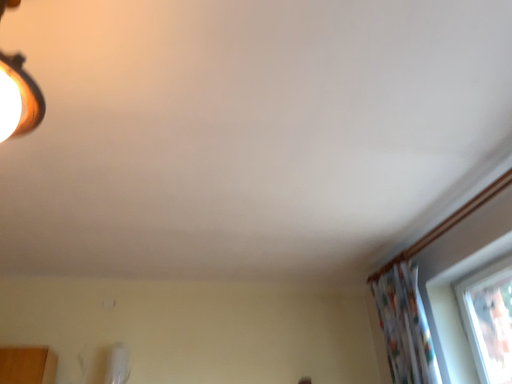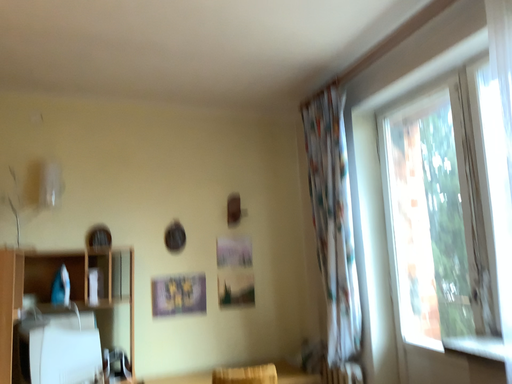
Question: How did the camera likely rotate when shooting the video?

Choices:
 (A) rotated upward
 (B) rotated downward

Answer: (B)